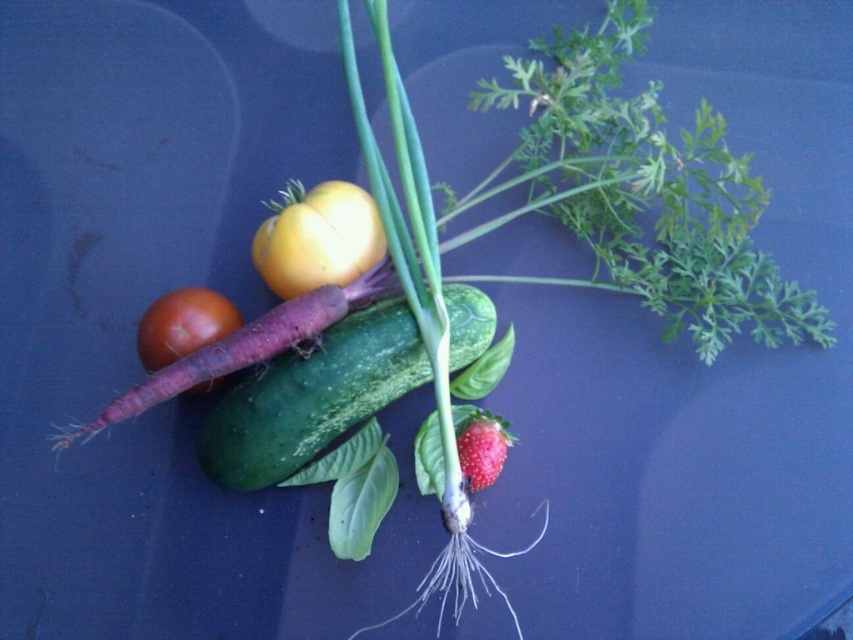
You are standing in front of a table with vegetables arranged on it. There are two points marked on the table surface. One is at coordinates point (196, 336) and the other is at point (459, 433). Which point is closer to you?

Point (196, 336) is closer to the viewer than point (459, 433).

You are arranging vegetables on a shelf and need to know which one is wider. Which is wider between the green matte cucumber at center and the yellow matte tomato at center?

The green matte cucumber at center is wider than the yellow matte tomato at center according to the description.